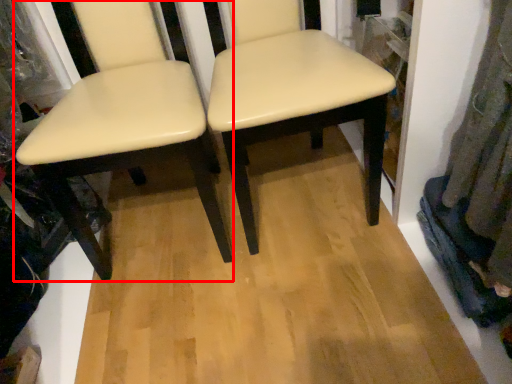
Question: Where is chair (annotated by the red box) located in relation to chair in the image?

Choices:
 (A) left
 (B) right

Answer: (A)